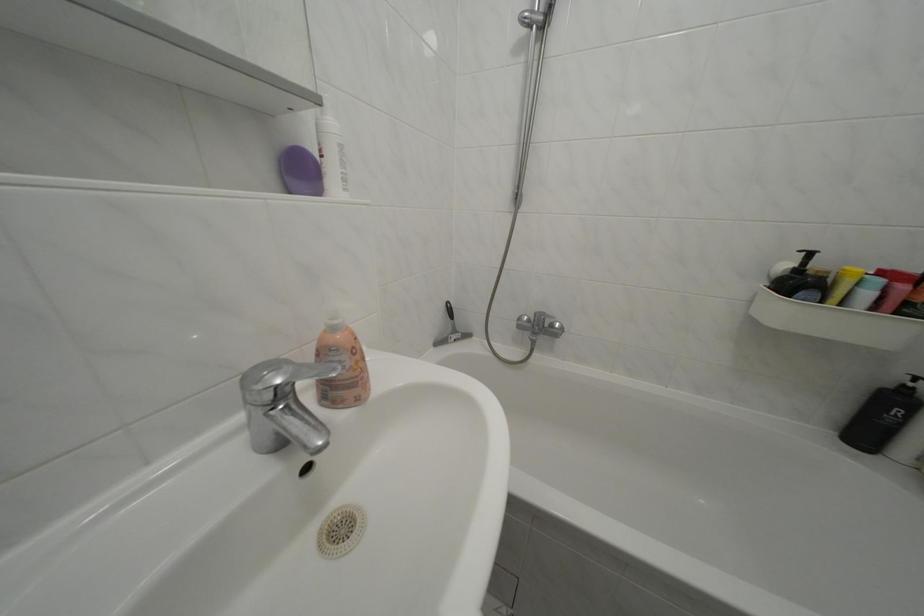
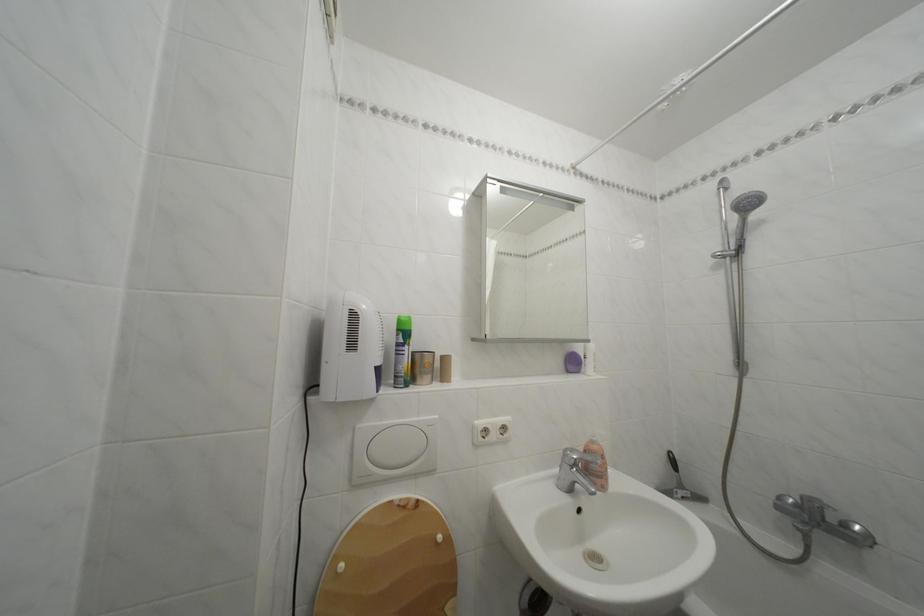
Locate, in the second image, the point that corresponds to point (342, 334) in the first image.

(602, 448)